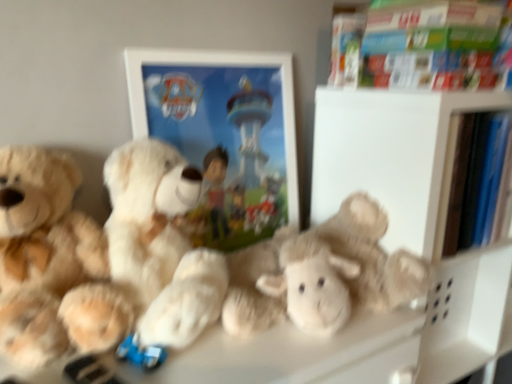
Question: Which direction should I rotate to look at fluffy white teddy bear at center, which is the 1th teddy bear from right to left, — up or down?

Choices:
 (A) up
 (B) down

Answer: (B)

Question: Considering the relative sizes of white matte picture frame at center and soft plush teddy bear at left, which ranks as the 3th teddy bear in right-to-left order, in the image provided, is white matte picture frame at center wider than soft plush teddy bear at left, which ranks as the 3th teddy bear in right-to-left order,?

Choices:
 (A) no
 (B) yes

Answer: (A)

Question: Considering the relative sizes of white matte picture frame at center and soft plush teddy bear at left, which ranks as the 3th teddy bear in right-to-left order, in the image provided, is white matte picture frame at center smaller than soft plush teddy bear at left, which ranks as the 3th teddy bear in right-to-left order,?

Choices:
 (A) yes
 (B) no

Answer: (A)

Question: Considering the relative positions of white matte picture frame at center and soft plush teddy bear at left, which ranks as the 3th teddy bear in right-to-left order, in the image provided, is white matte picture frame at center to the right of soft plush teddy bear at left, which ranks as the 3th teddy bear in right-to-left order, from the viewer's perspective?

Choices:
 (A) no
 (B) yes

Answer: (B)

Question: Considering the relative positions of white matte picture frame at center and soft plush teddy bear at left, which ranks as the first teddy bear in left-to-right order, in the image provided, is white matte picture frame at center in front of soft plush teddy bear at left, which ranks as the first teddy bear in left-to-right order,?

Choices:
 (A) no
 (B) yes

Answer: (A)

Question: Is white matte picture frame at center with soft plush teddy bear at left, which ranks as the 3th teddy bear in right-to-left order?

Choices:
 (A) no
 (B) yes

Answer: (A)

Question: From the image's perspective, is white matte picture frame at center above soft plush teddy bear at left, which ranks as the first teddy bear in left-to-right order?

Choices:
 (A) no
 (B) yes

Answer: (B)

Question: From the image's perspective, does hardcover book at upper right appear lower than soft plush teddy bear at left, which ranks as the 3th teddy bear in right-to-left order?

Choices:
 (A) no
 (B) yes

Answer: (A)

Question: From a real-world perspective, is hardcover book at upper right positioned over soft plush teddy bear at left, which ranks as the 3th teddy bear in right-to-left order, based on gravity?

Choices:
 (A) yes
 (B) no

Answer: (A)

Question: Does hardcover book at upper right have a greater width compared to soft plush teddy bear at left, which ranks as the 3th teddy bear in right-to-left order?

Choices:
 (A) yes
 (B) no

Answer: (B)

Question: Is hardcover book at upper right to the left of soft plush teddy bear at left, which ranks as the 3th teddy bear in right-to-left order, from the viewer's perspective?

Choices:
 (A) yes
 (B) no

Answer: (B)

Question: From the image's perspective, does hardcover book at upper right appear higher than soft plush teddy bear at left, which ranks as the 3th teddy bear in right-to-left order?

Choices:
 (A) no
 (B) yes

Answer: (B)

Question: Does hardcover book at upper right come behind soft plush teddy bear at left, which ranks as the first teddy bear in left-to-right order?

Choices:
 (A) no
 (B) yes

Answer: (B)

Question: Is soft plush teddy bear at left, which ranks as the first teddy bear in left-to-right order, at the left side of hardcover book at upper right?

Choices:
 (A) yes
 (B) no

Answer: (A)